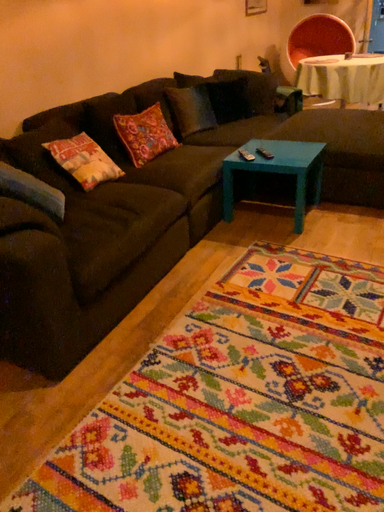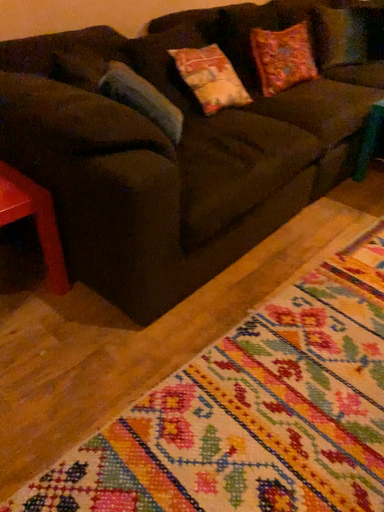
Question: How did the camera likely rotate when shooting the video?

Choices:
 (A) rotated upward
 (B) rotated downward

Answer: (B)